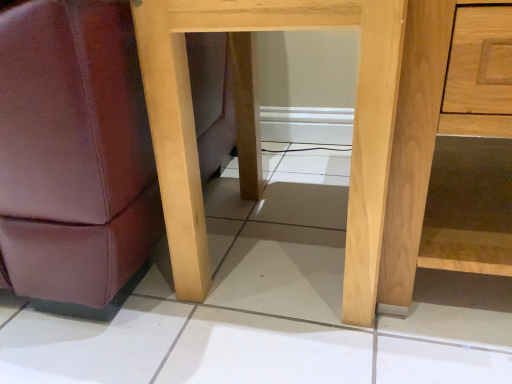
You are a GUI agent. You are given a task and a screenshot of the screen. Output one action in this format:
    pyautogui.click(x=<x>, y=<y>)
    Task: Click on the free area behind natural wood table at center
    The image size is (512, 384).
    Given the screenshot: What is the action you would take?
    pyautogui.click(x=288, y=176)